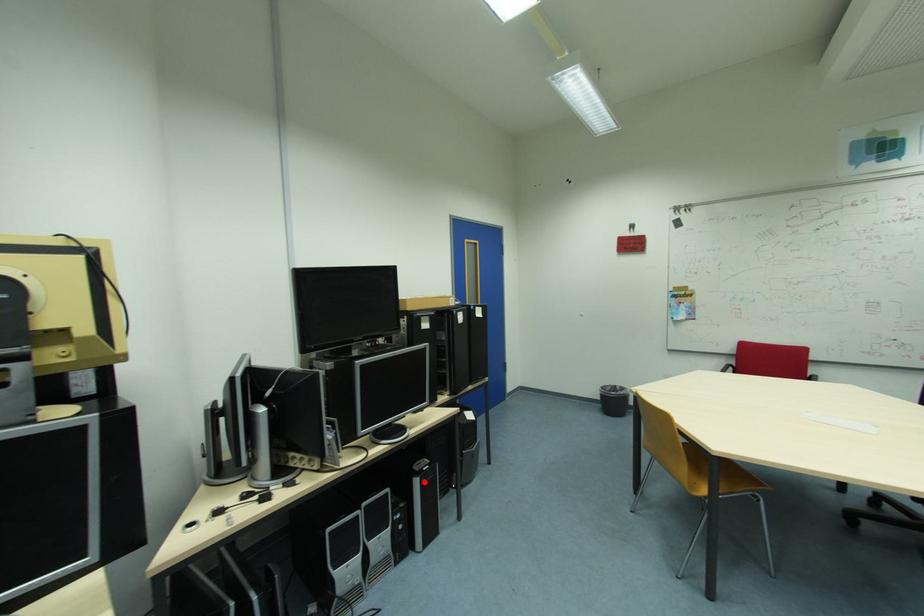
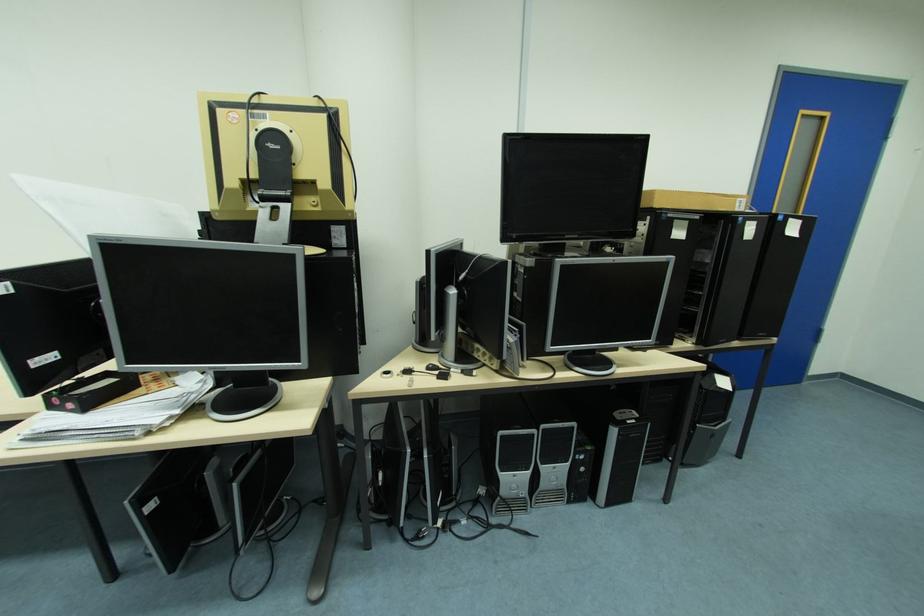
The point at the highlighted location is marked in the first image. Where is the corresponding point in the second image?

(621, 432)